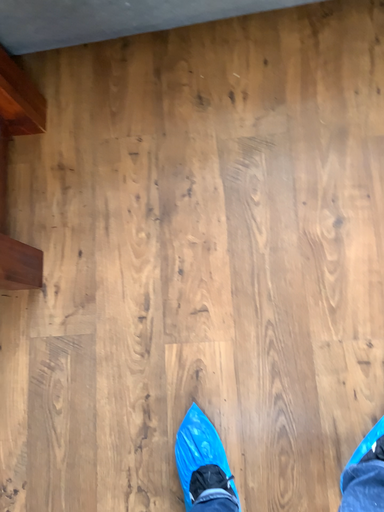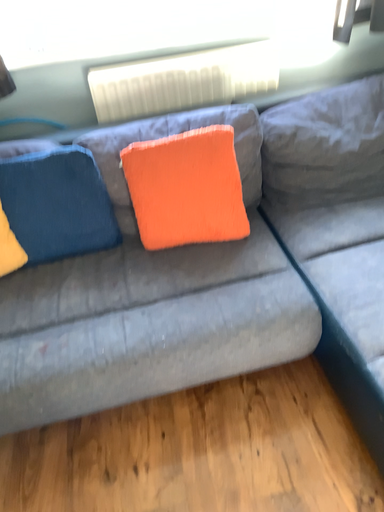
Question: Which way did the camera rotate in the video?

Choices:
 (A) rotated upward
 (B) rotated downward

Answer: (A)